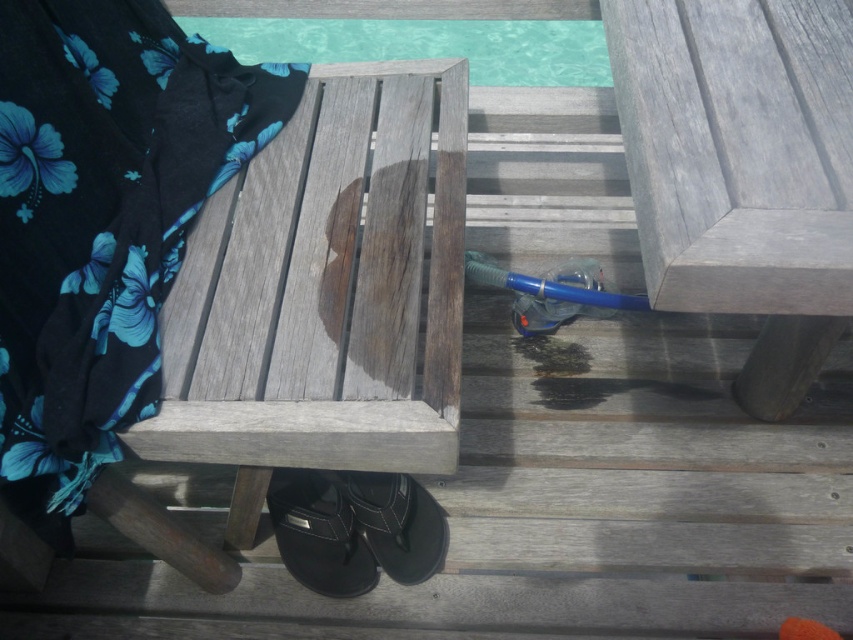
You are a guest at this poolside area and need to place your black leather sandal at lower center near the clear glass pool at upper center. Based on their sizes, which one occupies more space in the image?

The clear glass pool at upper center is larger in size than the black leather sandal at lower center, so the clear glass pool at upper center occupies more space in the image.

You are standing on the wooden deck leading down to the pool and need to sit down. Where exactly is the weathered wood bench at center located?

The weathered wood bench at center is located at point coordinates of (323, 292).

Consider the image. You are a guest at this poolside area and want to sit down. Which object should you choose between the weathered wood bench at center and the clear glass pool at upper center?

You should choose the weathered wood bench at center because it is located below the clear glass pool at upper center, making it a suitable seating option.